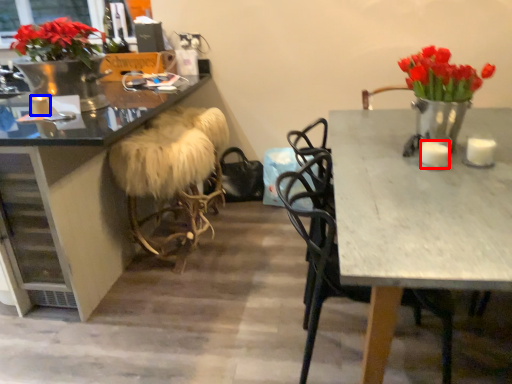
Question: Among these objects, which one is farthest to the camera, candle (highlighted by a red box) or candle (highlighted by a blue box)?

Choices:
 (A) candle
 (B) candle

Answer: (B)